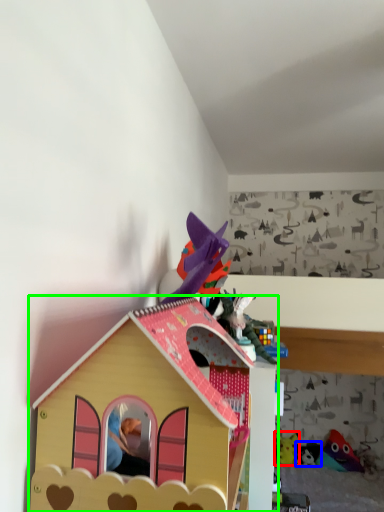
Question: Which object is positioned farthest from toy (highlighted by a red box)? Select from toy (highlighted by a blue box) and toy (highlighted by a green box).

Choices:
 (A) toy
 (B) toy

Answer: (B)